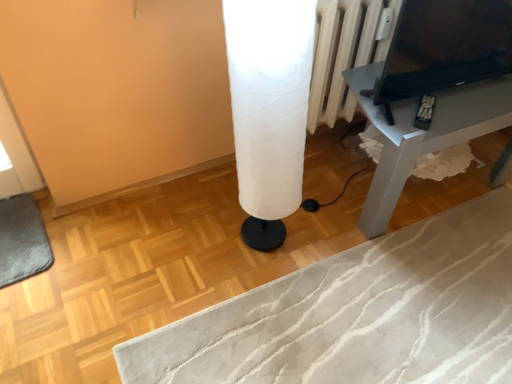
Question: Considering the relative sizes of white fabric lampshade at center and black glossy tv at upper right in the image provided, is white fabric lampshade at center thinner than black glossy tv at upper right?

Choices:
 (A) yes
 (B) no

Answer: (B)

Question: Is white fabric lampshade at center placed right next to black glossy tv at upper right?

Choices:
 (A) yes
 (B) no

Answer: (B)

Question: From the image's perspective, is white fabric lampshade at center located beneath black glossy tv at upper right?

Choices:
 (A) yes
 (B) no

Answer: (A)

Question: Is white fabric lampshade at center at the left side of black glossy tv at upper right?

Choices:
 (A) yes
 (B) no

Answer: (A)

Question: Can you confirm if white fabric lampshade at center is wider than black glossy tv at upper right?

Choices:
 (A) yes
 (B) no

Answer: (A)

Question: Considering the positions of white fabric lampshade at center and matte gray table at right in the image, is white fabric lampshade at center bigger or smaller than matte gray table at right?

Choices:
 (A) small
 (B) big

Answer: (A)

Question: Would you say white fabric lampshade at center is to the left or to the right of matte gray table at right in the picture?

Choices:
 (A) right
 (B) left

Answer: (B)

Question: Considering the positions of point (292, 82) and point (509, 102), is point (292, 82) closer or farther from the camera than point (509, 102)?

Choices:
 (A) closer
 (B) farther

Answer: (A)

Question: In terms of height, does white fabric lampshade at center look taller or shorter compared to matte gray table at right?

Choices:
 (A) short
 (B) tall

Answer: (B)

Question: Looking at the image, does matte gray table at right seem bigger or smaller compared to black glossy tv at upper right?

Choices:
 (A) big
 (B) small

Answer: (A)

Question: Is matte gray table at right taller or shorter than black glossy tv at upper right?

Choices:
 (A) short
 (B) tall

Answer: (B)

Question: Is matte gray table at right wider or thinner than black glossy tv at upper right?

Choices:
 (A) wide
 (B) thin

Answer: (A)

Question: Which is correct: matte gray table at right is inside black glossy tv at upper right, or outside of it?

Choices:
 (A) outside
 (B) inside

Answer: (A)

Question: Considering the positions of white fabric lampshade at center and black glossy tv at upper right in the image, is white fabric lampshade at center wider or thinner than black glossy tv at upper right?

Choices:
 (A) thin
 (B) wide

Answer: (B)

Question: Is white fabric lampshade at center to the left or to the right of black glossy tv at upper right in the image?

Choices:
 (A) right
 (B) left

Answer: (B)